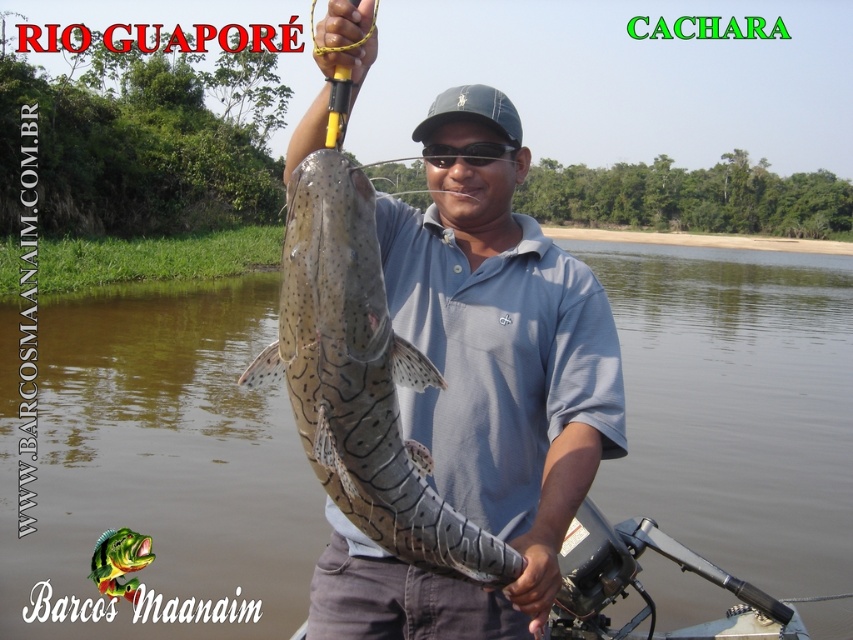
You are a photographer trying to capture the man fishing. You want to focus on the matte blue shirt at center without the brown water at center overlapping it. Is this possible given their positions?

The brown water at center is positioned over matte blue shirt at center, so the water overlaps the shirt in the image. To avoid overlap, adjust the camera angle or move the shirt, but since the shirt is part of the man, you cannot move it. Thus, capturing the shirt without water overlap isn

Looking at the scene, which object occupies more horizontal space in the image between the brown water at center and the speckled skin catfish at center?

The brown water at center occupies more horizontal space than the speckled skin catfish at center because its width is larger.